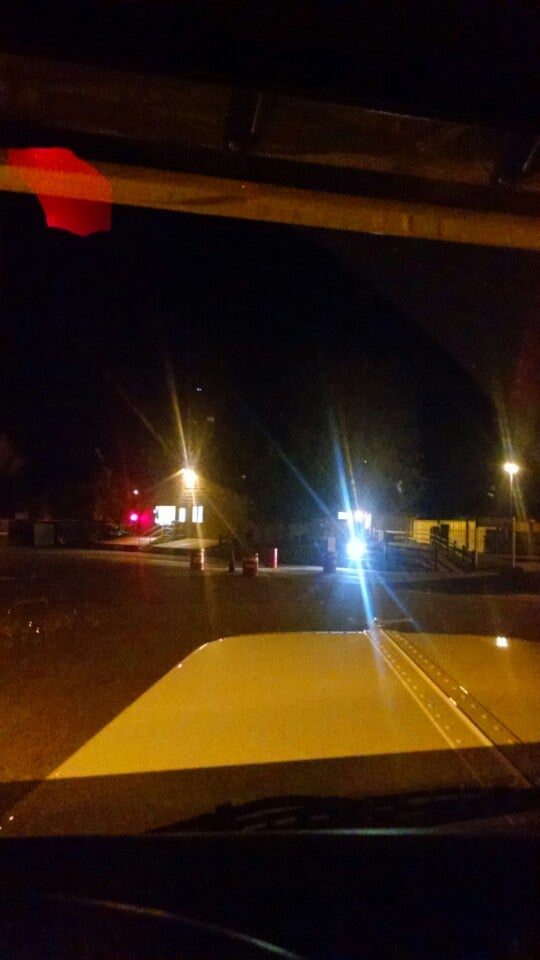
Find the location of a particular element. The image size is (540, 960). light is located at coordinates (357, 542), (191, 474), (512, 468).